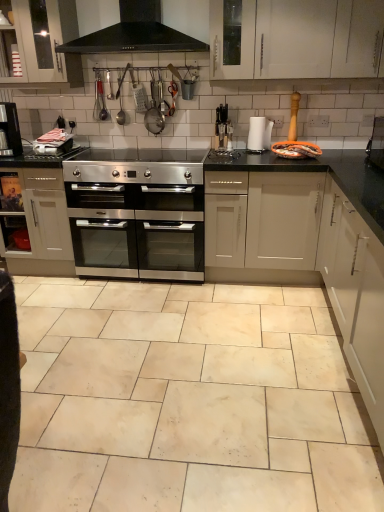
You are a GUI agent. You are given a task and a screenshot of the screen. Output one action in this format:
    pyautogui.click(x=<x>, y=<y>)
    Task: Click on the black plastic coffee machine at left
    This screenshot has height=512, width=384.
    Given the screenshot: What is the action you would take?
    pyautogui.click(x=11, y=126)

Find the location of `white glossy cabinet at upper left, which ranks as the second cabinetry in right-to-left order`. white glossy cabinet at upper left, which ranks as the second cabinetry in right-to-left order is located at coordinates [x=48, y=42].

Is black plastic coffee machine at left aimed at white glossy cabinet at upper left, which ranks as the second cabinetry in right-to-left order?

No, black plastic coffee machine at left is not aimed at white glossy cabinet at upper left, which ranks as the second cabinetry in right-to-left order.

Is black plastic coffee machine at left to the right of white glossy cabinet at upper left, which ranks as the second cabinetry in right-to-left order, from the viewer's perspective?

In fact, black plastic coffee machine at left is to the left of white glossy cabinet at upper left, which ranks as the second cabinetry in right-to-left order.

How many degrees apart are the facing directions of black plastic coffee machine at left and white glossy cabinet at upper left, arranged as the 3th cabinetry when ordered from the bottom?

There is a 1.41-degree angle between the facing directions of black plastic coffee machine at left and white glossy cabinet at upper left, arranged as the 3th cabinetry when ordered from the bottom.

Is point (4, 102) farther from camera compared to point (75, 30)?

Yes, point (4, 102) is farther from viewer.

From the image's perspective, which one is positioned lower, stainless steel gas stove at center or white paper towel at center, positioned as the first appliance in right-to-left order?

stainless steel gas stove at center is shown below in the image.

Could you tell me if stainless steel gas stove at center is turned towards white paper towel at center, positioned as the first appliance in right-to-left order?

No, stainless steel gas stove at center is not oriented towards white paper towel at center, positioned as the first appliance in right-to-left order.

Who is more distant, stainless steel gas stove at center or white paper towel at center, the 2th appliance positioned from the left?

white paper towel at center, the 2th appliance positioned from the left.

How many degrees apart are the facing directions of stainless steel gas stove at center and white paper towel at center, positioned as the first appliance in right-to-left order?

The facing directions of stainless steel gas stove at center and white paper towel at center, positioned as the first appliance in right-to-left order, are 0.961 degrees apart.

Which object is more forward, stainless steel oven at center or black granite countertop at center?

Positioned in front is black granite countertop at center.

Are stainless steel oven at center and black granite countertop at center far apart?

Indeed, stainless steel oven at center is not near black granite countertop at center.

Does stainless steel oven at center appear on the right side of black granite countertop at center?

No.

Considering the sizes of objects stainless steel oven at center and black granite countertop at center in the image provided, who is shorter, stainless steel oven at center or black granite countertop at center?

With less height is stainless steel oven at center.

Is stainless steel gas stove at center taller or shorter than white matte cabinet at right, which ranks as the 1th cabinetry in bottom-to-top order?

stainless steel gas stove at center is shorter than white matte cabinet at right, which ranks as the 1th cabinetry in bottom-to-top order.

From the image's perspective, is stainless steel gas stove at center under white matte cabinet at right, the third cabinetry viewed from the left?

Incorrect, from the image's perspective, stainless steel gas stove at center is higher than white matte cabinet at right, the third cabinetry viewed from the left.

Does stainless steel gas stove at center turn towards white matte cabinet at right, positioned as the 1th cabinetry in right-to-left order?

No, stainless steel gas stove at center is not facing towards white matte cabinet at right, positioned as the 1th cabinetry in right-to-left order.

Can you confirm if stainless steel gas stove at center is smaller than white matte cabinet at right, which ranks as the 3th cabinetry in top-to-bottom order?

Indeed, stainless steel gas stove at center has a smaller size compared to white matte cabinet at right, which ranks as the 3th cabinetry in top-to-bottom order.

Considering the positions of objects black plastic coffee machine at center, which is the 1th appliance from left to right, and stainless steel oven at center in the image provided, who is more to the right, black plastic coffee machine at center, which is the 1th appliance from left to right, or stainless steel oven at center?

black plastic coffee machine at center, which is the 1th appliance from left to right.

Considering the sizes of objects black plastic coffee machine at center, the 2th appliance when ordered from right to left, and stainless steel oven at center in the image provided, who is thinner, black plastic coffee machine at center, the 2th appliance when ordered from right to left, or stainless steel oven at center?

Thinner between the two is black plastic coffee machine at center, the 2th appliance when ordered from right to left.

From a real-world perspective, is black plastic coffee machine at center, which is the 1th appliance from left to right, physically above stainless steel oven at center?

Yes.

Is black plastic coffee machine at center, which is the 1th appliance from left to right, positioned far away from stainless steel oven at center?

No.

Identify the location of ceramic tile in front of the black granite countertop at center. This screenshot has height=512, width=384. (187, 401).

Does black granite countertop at center appear on the right side of beige marble tile at center?

Indeed, black granite countertop at center is positioned on the right side of beige marble tile at center.

Is black granite countertop at center positioned with its back to beige marble tile at center?

No, beige marble tile at center is not at the back of black granite countertop at center.

Does point (378, 196) appear closer or farther from the camera than point (130, 455)?

Point (378, 196) is positioned farther from the camera compared to point (130, 455).

From the image's perspective, is white glossy cabinet at upper left, marked as the 1th cabinetry in a top-to-bottom arrangement, positioned above or below black plastic coffee machine at center, the 2th appliance when ordered from right to left?

white glossy cabinet at upper left, marked as the 1th cabinetry in a top-to-bottom arrangement, is situated higher than black plastic coffee machine at center, the 2th appliance when ordered from right to left, in the image.

Which object is closer to the camera taking this photo, white glossy cabinet at upper left, which ranks as the second cabinetry in right-to-left order, or black plastic coffee machine at center, which is the 1th appliance from left to right?

Positioned in front is white glossy cabinet at upper left, which ranks as the second cabinetry in right-to-left order.

Measure the distance between white glossy cabinet at upper left, which ranks as the second cabinetry in right-to-left order, and black plastic coffee machine at center, which is the 1th appliance from left to right.

white glossy cabinet at upper left, which ranks as the second cabinetry in right-to-left order, is 4.15 feet away from black plastic coffee machine at center, which is the 1th appliance from left to right.

Does white glossy cabinet at upper left, positioned as the second cabinetry in left-to-right order, have a smaller size compared to black plastic coffee machine at center, the 2th appliance when ordered from right to left?

No.

There is a black plastic coffee machine at left. Where is `cabinetry above it (from a real-world perspective)`? cabinetry above it (from a real-world perspective) is located at coordinates (48, 42).

At what (x,y) coordinates should I click in order to perform the action: click on appliance that is the 2nd object to the right of the stainless steel gas stove at center, starting at the anchor. Please return your answer as a coordinate pair (x, y). Image resolution: width=384 pixels, height=512 pixels. Looking at the image, I should click on (259, 134).

When comparing their distances from black granite countertop at center, does black matte exhaust hood at upper center or black plastic coffee machine at left seem further?

black plastic coffee machine at left is positioned further to the anchor black granite countertop at center.

Estimate the real-world distances between objects in this image. Which object is closer to white paper towel at center, the 2th appliance positioned from the left, satin silver oven at center, which is counted as the 3th cabinetry, starting from the right, or white glossy cabinet at upper left, arranged as the 3th cabinetry when ordered from the bottom?

The object closer to white paper towel at center, the 2th appliance positioned from the left, is white glossy cabinet at upper left, arranged as the 3th cabinetry when ordered from the bottom.

Looking at the image, which one is located closer to white paper towel at center, the 2th appliance positioned from the left, black plastic coffee machine at left or black plastic coffee machine at center, the 2th appliance when ordered from right to left?

black plastic coffee machine at center, the 2th appliance when ordered from right to left, is closer to white paper towel at center, the 2th appliance positioned from the left.

Based on their spatial positions, is stainless steel oven at center or white matte cabinet at right, the third cabinetry viewed from the left, closer to white paper towel at center, positioned as the first appliance in right-to-left order?

stainless steel oven at center lies closer to white paper towel at center, positioned as the first appliance in right-to-left order, than the other object.

From the image, which object appears to be farther from beige marble tile at center, white matte cabinet at right, the third cabinetry viewed from the left, or black granite countertop at center?

black granite countertop at center is positioned further to the anchor beige marble tile at center.

Based on their spatial positions, is beige marble tile at center or satin silver oven at center, marked as the 2th cabinetry in a bottom-to-top arrangement, closer to black matte exhaust hood at upper center?

satin silver oven at center, marked as the 2th cabinetry in a bottom-to-top arrangement.

Which object lies nearer to the anchor point white paper towel at center, positioned as the first appliance in right-to-left order, satin silver oven at center, the first cabinetry viewed from the left, or black matte exhaust hood at upper center?

The object closer to white paper towel at center, positioned as the first appliance in right-to-left order, is black matte exhaust hood at upper center.

When comparing their distances from white glossy cabinet at upper left, positioned as the second cabinetry in left-to-right order, does white matte cabinet at right, the third cabinetry viewed from the left, or beige marble tile at center seem further?

white matte cabinet at right, the third cabinetry viewed from the left, is further to white glossy cabinet at upper left, positioned as the second cabinetry in left-to-right order.

The height and width of the screenshot is (512, 384). Identify the location of oven that lies between white glossy cabinet at upper left, positioned as the second cabinetry in left-to-right order, and beige marble tile at center from top to bottom. (139, 230).

Find the location of `exhaust hood situated between black plastic coffee machine at left and black granite countertop at center from left to right`. exhaust hood situated between black plastic coffee machine at left and black granite countertop at center from left to right is located at coordinates (135, 33).

The image size is (384, 512). In order to click on oven located between stainless steel gas stove at center and black granite countertop at center in the left-right direction in this screenshot , I will do 139,230.

You are a GUI agent. You are given a task and a screenshot of the screen. Output one action in this format:
    pyautogui.click(x=<x>, y=<y>)
    Task: Click on the gas stove between black plastic coffee machine at left and stainless steel oven at center
    This screenshot has height=512, width=384.
    Given the screenshot: What is the action you would take?
    pyautogui.click(x=136, y=166)